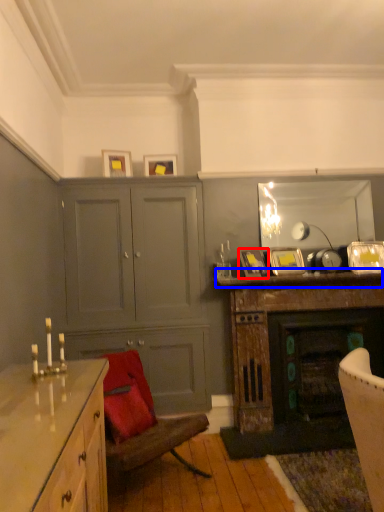
Question: Which object appears closest to the camera in this image, picture frame (highlighted by a red box) or mantle (highlighted by a blue box)?

Choices:
 (A) picture frame
 (B) mantle

Answer: (B)